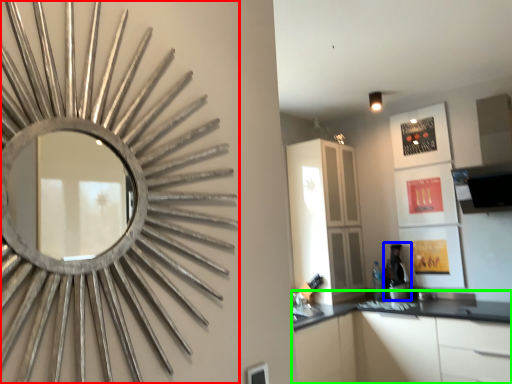
Question: Which is nearer to the oval (highlighted by a red box)? coffee machine (highlighted by a blue box) or cabinetry (highlighted by a green box).

Choices:
 (A) coffee machine
 (B) cabinetry

Answer: (B)